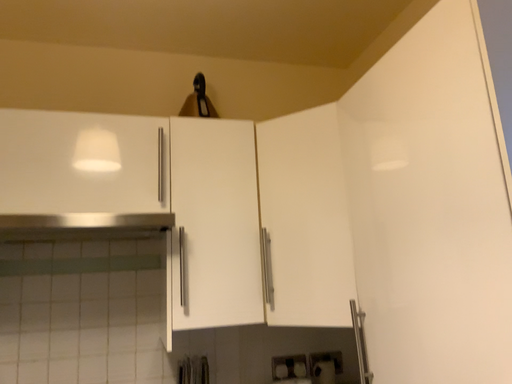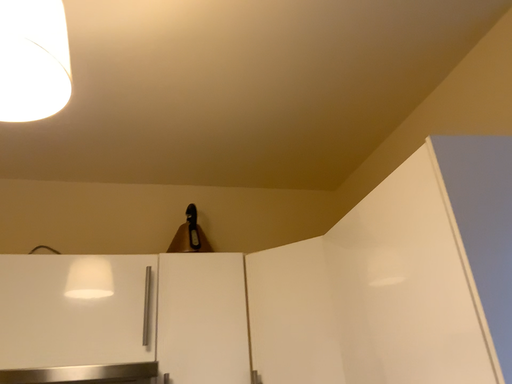
Question: Which way did the camera rotate in the video?

Choices:
 (A) rotated downward
 (B) rotated upward

Answer: (B)